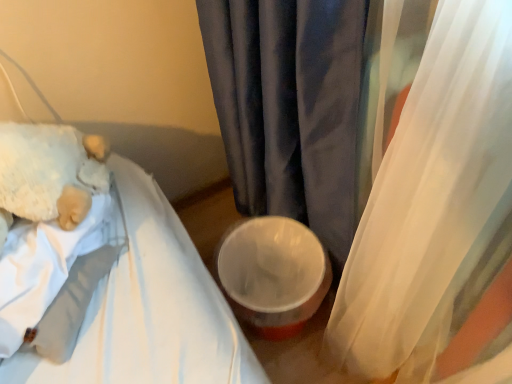
At what (x,y) coordinates should I click in order to perform the action: click on white fluffy pillow at left. Please return your answer as a coordinate pair (x, y). Looking at the image, I should click on (48, 173).

What do you see at coordinates (48, 173) in the screenshot? I see `white fluffy pillow at left` at bounding box center [48, 173].

Where is `white fluffy pillow at left`? The width and height of the screenshot is (512, 384). white fluffy pillow at left is located at coordinates (48, 173).